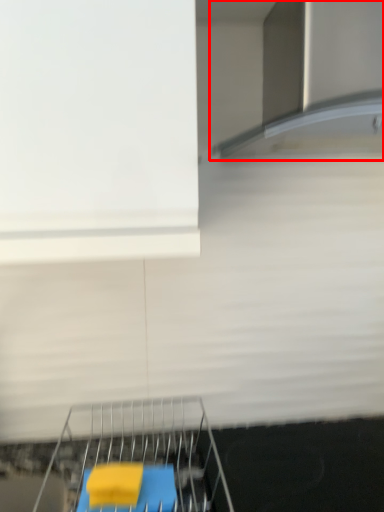
Question: From the image's perspective, where is exhaust hood (annotated by the red box) located in relation to furniture in the image?

Choices:
 (A) below
 (B) above

Answer: (B)